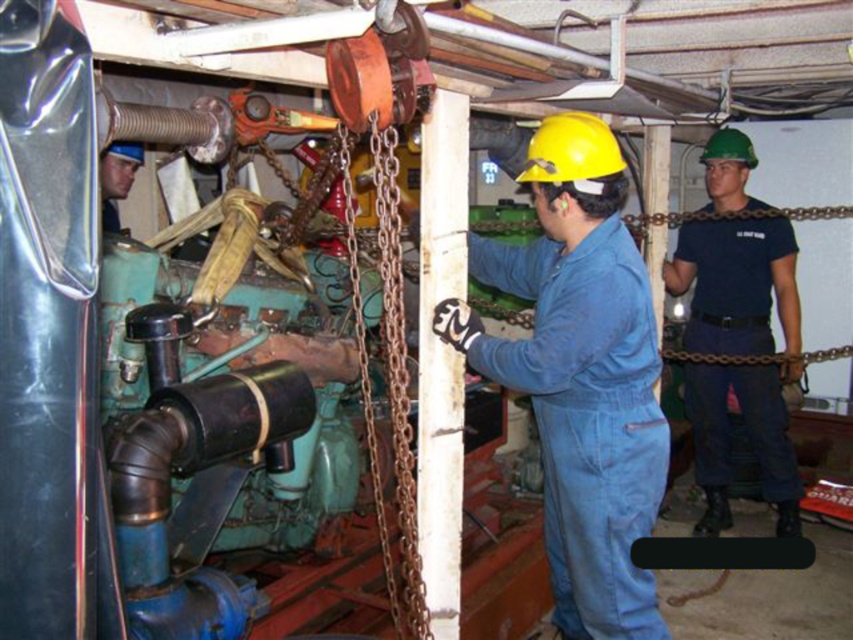
You are a safety inspector in this industrial setting. You notice the dark blue uniform at center and the matte black helmet at upper left. Which object is closer to you, and why?

The dark blue uniform at center is closer to you because it is further to the viewer than the matte black helmet at upper left, meaning it appears nearer in the visual perspective.

You are a safety inspector in this industrial setting. You need to ensure that all workers are wearing proper safety gear. The blue denim jumpsuit at center and the matte black helmet at upper left are both present. Which worker is more likely to be compliant with safety regulations based on their attire?

The blue denim jumpsuit at center is much taller than the matte black helmet at upper left, but the matte black helmet at upper left is the one wearing proper safety gear as it is a helmet. The blue denim jumpsuit at center might not be compliant if they are not wearing a helmet.